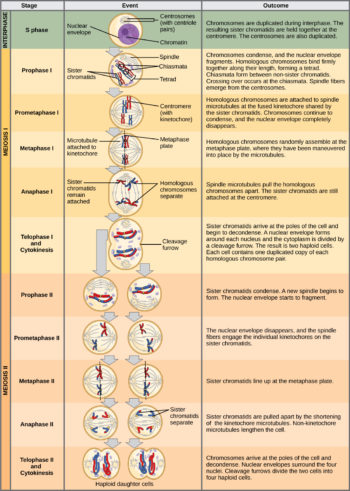
The height and width of the screenshot is (491, 350). In order to click on column in this screenshot , I will do `click(5, 148)`.